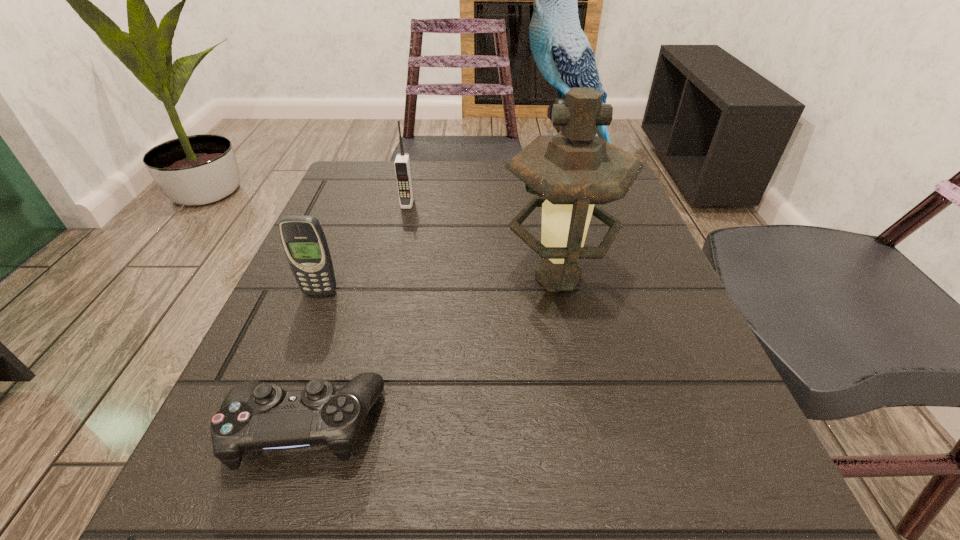
You are a GUI agent. You are given a task and a screenshot of the screen. Output one action in this format:
    pyautogui.click(x=<x>, y=<y>)
    Task: Click on the tallest object
    
    Given the screenshot: What is the action you would take?
    pyautogui.click(x=561, y=50)

Where is `oil lamp`? oil lamp is located at coordinates (575, 171).

Where is `the right cellular telephone`? Image resolution: width=960 pixels, height=540 pixels. the right cellular telephone is located at coordinates (402, 165).

Where is `the third tallest object`? the third tallest object is located at coordinates (402, 165).

Identify the location of the left cellular telephone. (303, 239).

At what (x,y) coordinates should I click in order to perform the action: click on the nearer cellular telephone. Please return your answer as a coordinate pair (x, y). Image resolution: width=960 pixels, height=540 pixels. Looking at the image, I should click on pos(303,239).

In order to click on control in this screenshot , I will do `click(254, 416)`.

Identify the location of the shortest object. Image resolution: width=960 pixels, height=540 pixels. (254, 416).

Locate an element on the screen. The width and height of the screenshot is (960, 540). blank area located 0.380m on the face of the parakeet is located at coordinates (352, 182).

Locate an element on the screen. This screenshot has width=960, height=540. vacant space located 0.220m on the face of the parakeet is located at coordinates (422, 182).